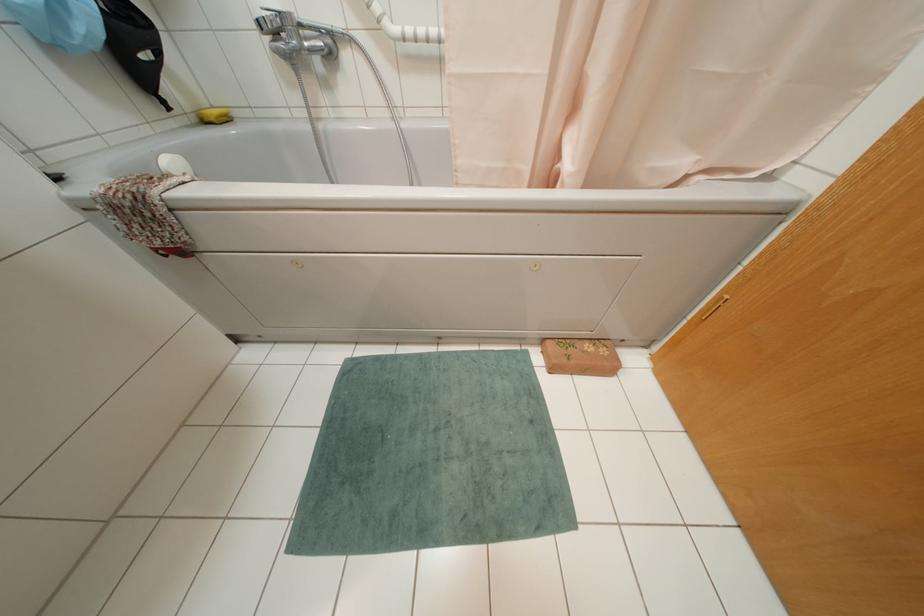
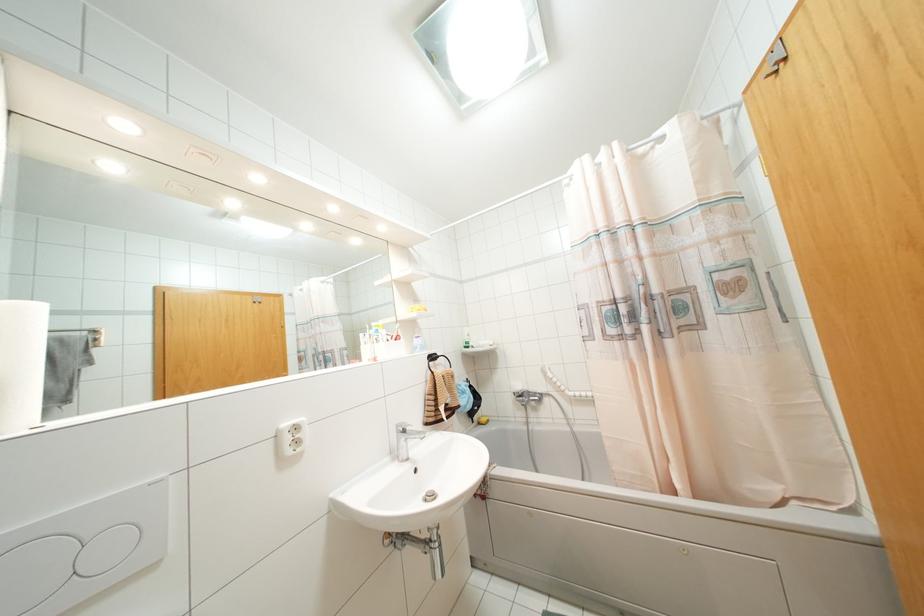
Find the pixel in the second image that matches [202,121] in the first image.

(479, 423)